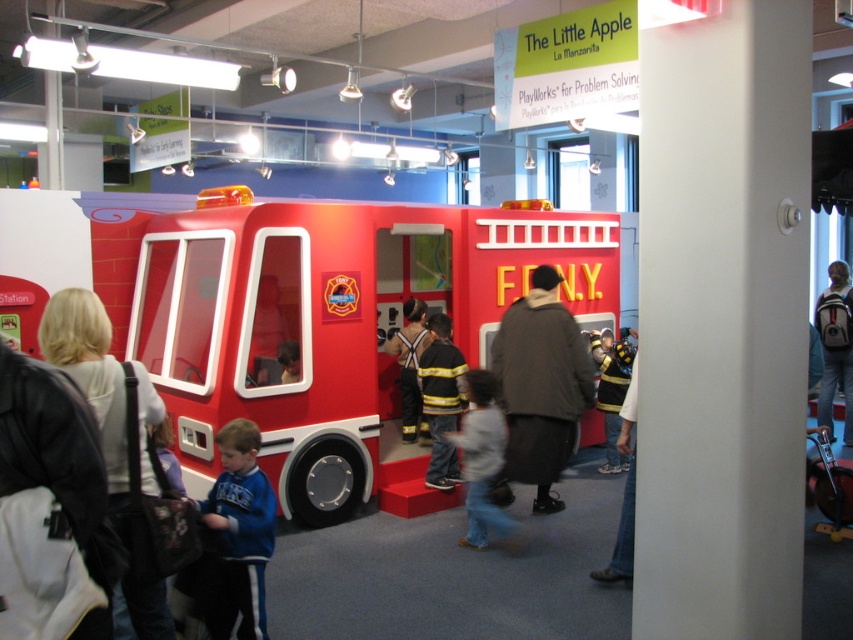
Is blue fleece jacket at lower left closer to the viewer compared to firefighter uniform at center?

Yes, blue fleece jacket at lower left is closer to the viewer.

Is blue fleece jacket at lower left wider than firefighter uniform at center?

No.

The image size is (853, 640). Describe the element at coordinates (236, 536) in the screenshot. I see `blue fleece jacket at lower left` at that location.

Find the location of a particular element. blue fleece jacket at lower left is located at coordinates (236, 536).

Is point (236, 442) less distant than point (473, 496)?

Yes, point (236, 442) is closer to viewer.

Does blue fleece jacket at lower left have a lesser height compared to light gray cotton shirt at center?

Yes, blue fleece jacket at lower left is shorter than light gray cotton shirt at center.

Who is more forward, (228,548) or (498,516)?

Point (228,548)

Where is `blue fleece jacket at lower left`? The width and height of the screenshot is (853, 640). blue fleece jacket at lower left is located at coordinates (236, 536).

Which is in front, point (476, 465) or point (838, 356)?

Point (476, 465) is in front.

Who is higher up, light gray cotton shirt at center or gray backpack at right?

Positioned higher is gray backpack at right.

You are a GUI agent. You are given a task and a screenshot of the screen. Output one action in this format:
    pyautogui.click(x=<x>, y=<y>)
    Task: Click on the light gray cotton shirt at center
    The image size is (853, 640).
    Given the screenshot: What is the action you would take?
    pyautogui.click(x=480, y=458)

What are the coordinates of `light gray cotton shirt at center` in the screenshot? It's located at (480, 458).